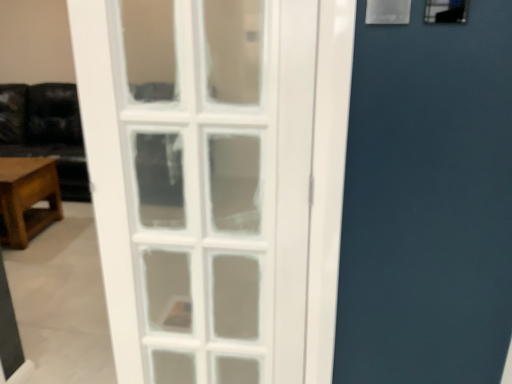
Identify the location of brown wooden table at left. (27, 198).

The width and height of the screenshot is (512, 384). What do you see at coordinates (27, 198) in the screenshot?
I see `brown wooden table at left` at bounding box center [27, 198].

Find the location of a particular element. This screenshot has height=384, width=512. brown wooden table at left is located at coordinates (27, 198).